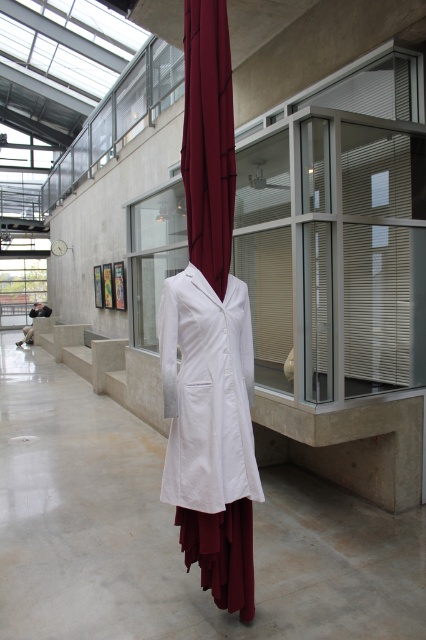
You are standing at the entrance of the room. There is a point marked at coordinates (210, 429). What object is located at that point?

The point at coordinates (210, 429) marks the location of the white smooth coat at center.

You are an interior designer assessing the space. You need to place a small decorative item between the white smooth coat at center and the burgundy fabric curtain at center. Which object should the item be placed closer to, based on their positions?

The white smooth coat at center is closer to the viewer than the burgundy fabric curtain at center, so the decorative item should be placed closer to the burgundy fabric curtain at center to maintain balance between the two objects.

You are an interior designer planning to hang a new coat in the room. The existing white smooth coat at center and the burgundy fabric curtain at center are both in the way. Which object should you move first to make space for the new coat?

The white smooth coat at center is bigger than the burgundy fabric curtain at center, so you should move the white smooth coat at center first to create more space for the new coat.